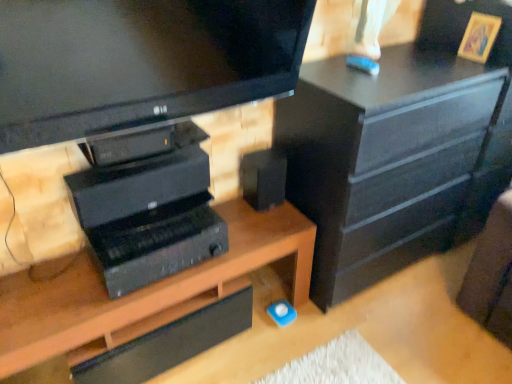
Locate an element on the screen. space that is in front of black matte speaker at center is located at coordinates (261, 228).